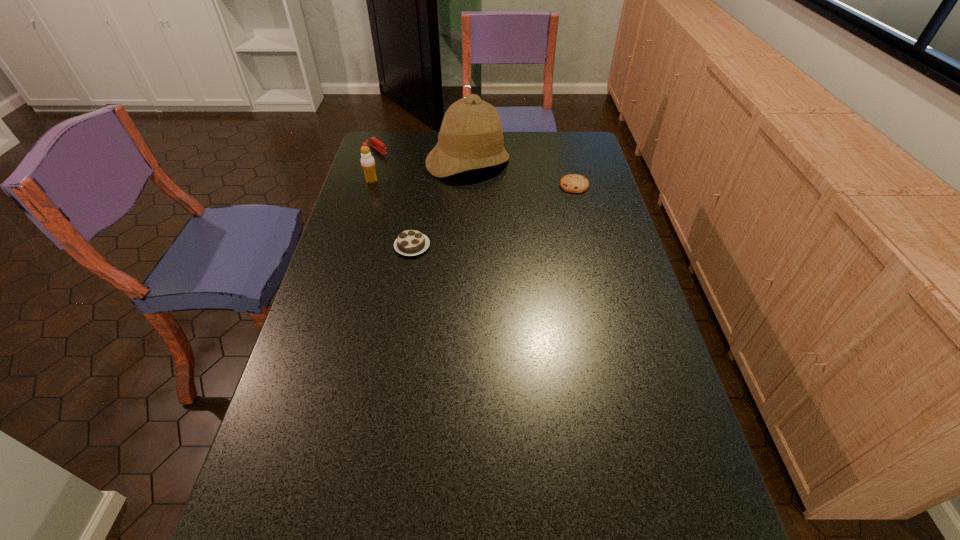
Image resolution: width=960 pixels, height=540 pixels. Identify the location of vacant spot on the desktop that is between the nearest object and the cookie and is positioned on the front-facing side of the stapler. (477, 222).

Locate an element on the screen. The width and height of the screenshot is (960, 540). vacant space on the desktop that is between the chocolate cake and the shortest object and is positioned on the front-facing side of the tallest object is located at coordinates (494, 215).

Where is `free space on the desktop that is between the nearest object and the shortest object and is positioned at the front with a straw on the icecream`? free space on the desktop that is between the nearest object and the shortest object and is positioned at the front with a straw on the icecream is located at coordinates (487, 218).